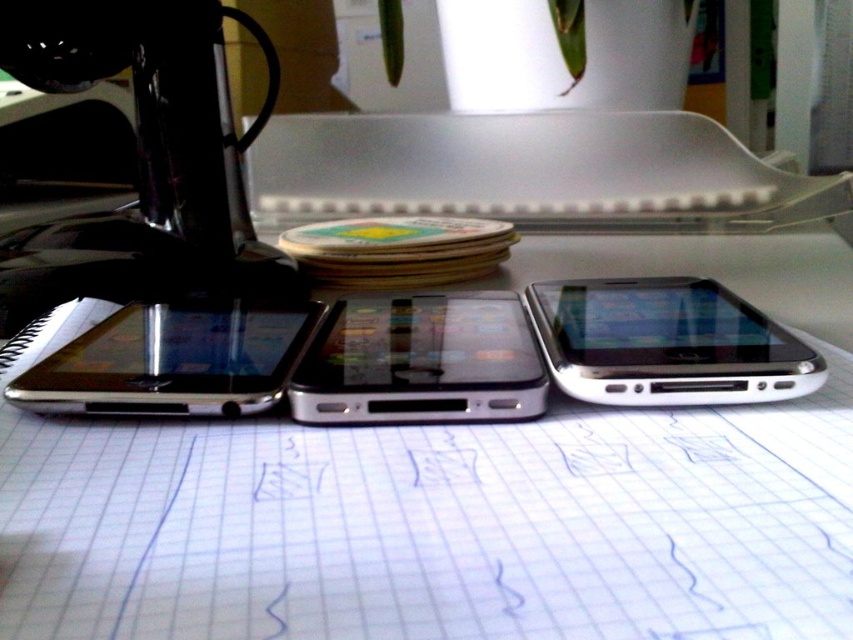
Which is above, white paper at center or white glossy smartphone at center?

white paper at center

Does white paper at center have a greater width compared to white glossy smartphone at center?

Indeed, white paper at center has a greater width compared to white glossy smartphone at center.

Between point (68, 515) and point (723, 372), which one is positioned behind?

The point (723, 372) is behind.

Locate an element on the screen. white paper at center is located at coordinates tap(456, 499).

Can you confirm if white paper at center is positioned below satin black smartphone at center?

No.

The width and height of the screenshot is (853, 640). What do you see at coordinates (456, 499) in the screenshot?
I see `white paper at center` at bounding box center [456, 499].

Does point (45, 518) come behind point (488, 417)?

No, (45, 518) is closer to viewer.

Locate an element on the screen. This screenshot has height=640, width=853. white paper at center is located at coordinates (456, 499).

Is white glossy smartphone at center thinner than satin black smartphone at left?

No.

Is white glossy smartphone at center wider than satin black smartphone at left?

Yes, white glossy smartphone at center is wider than satin black smartphone at left.

You are a GUI agent. You are given a task and a screenshot of the screen. Output one action in this format:
    pyautogui.click(x=<x>, y=<y>)
    Task: Click on the white glossy smartphone at center
    This screenshot has height=640, width=853.
    Given the screenshot: What is the action you would take?
    tap(666, 342)